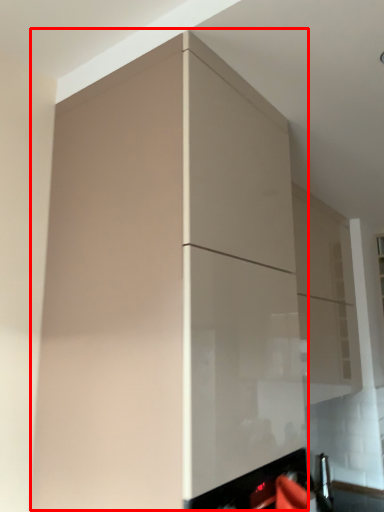
Question: From the image's perspective, what is the correct spatial positioning of cabinetry (annotated by the red box) in reference to cabinetry?

Choices:
 (A) below
 (B) above

Answer: (B)